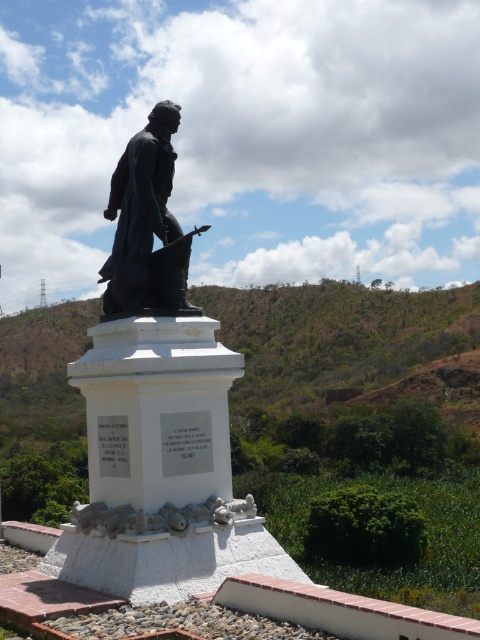
Which is above, green leafy hillside at center or bronze statue at center?

green leafy hillside at center

Can you confirm if green leafy hillside at center is shorter than bronze statue at center?

No.

The image size is (480, 640). I want to click on green leafy hillside at center, so tap(334, 337).

Locate an element on the screen. Image resolution: width=480 pixels, height=640 pixels. black polished statue at center is located at coordinates (157, 412).

Who is more distant from viewer, (x=220, y=541) or (x=168, y=305)?

The point (x=168, y=305) is more distant.

Identify the location of black polished statue at center. The height and width of the screenshot is (640, 480). (157, 412).

Is the position of black polished statue at center more distant than that of green leafy hillside at center?

No, black polished statue at center is in front of green leafy hillside at center.

Does point (92, 420) come in front of point (23, 310)?

Yes, point (92, 420) is in front of point (23, 310).

I want to click on black polished statue at center, so click(x=157, y=412).